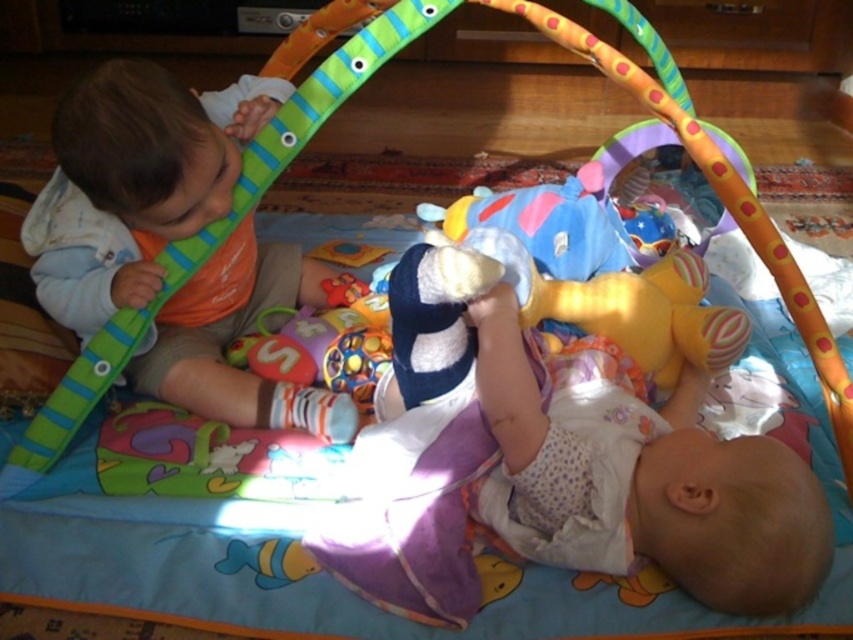
You are a parent trying to choose between placing a new toy on the matte orange bib at left or the white soft baby at lower right. Which object has a larger surface area to place the toy?

The matte orange bib at left has a larger surface area since its width surpasses that of the white soft baby at lower right.

You are a parent trying to ensure your baby is safe while playing. You see the matte orange bib at left and the white soft baby at lower right. Which item is placed on top of the other?

The matte orange bib at left is positioned over white soft baby at lower right.